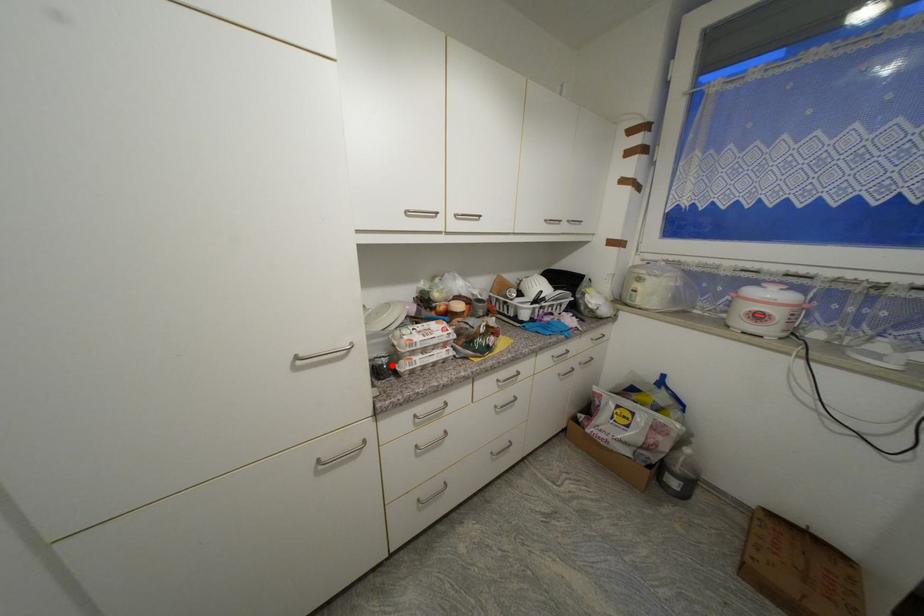
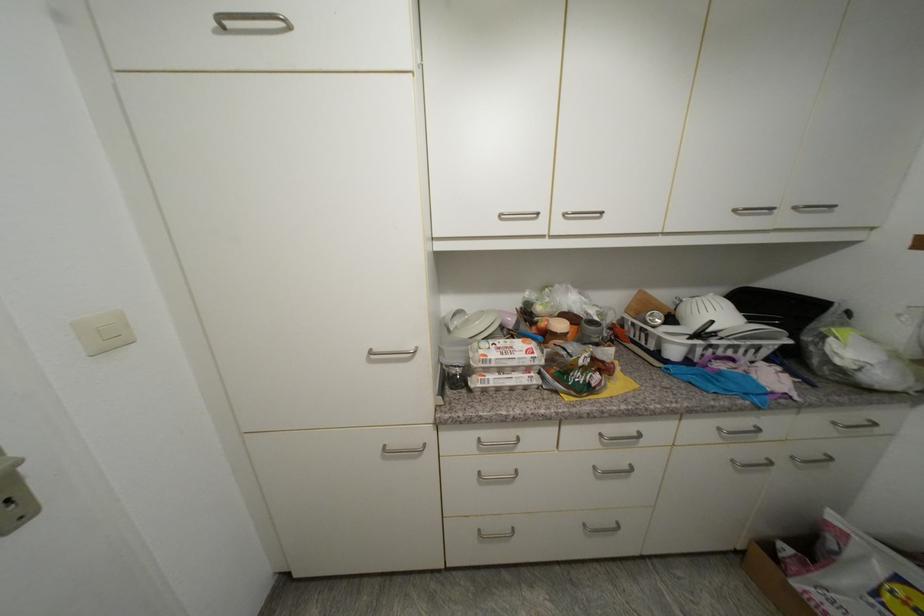
Where in the second image is the point corresponding to the highlighted location from the first image?

(466, 376)